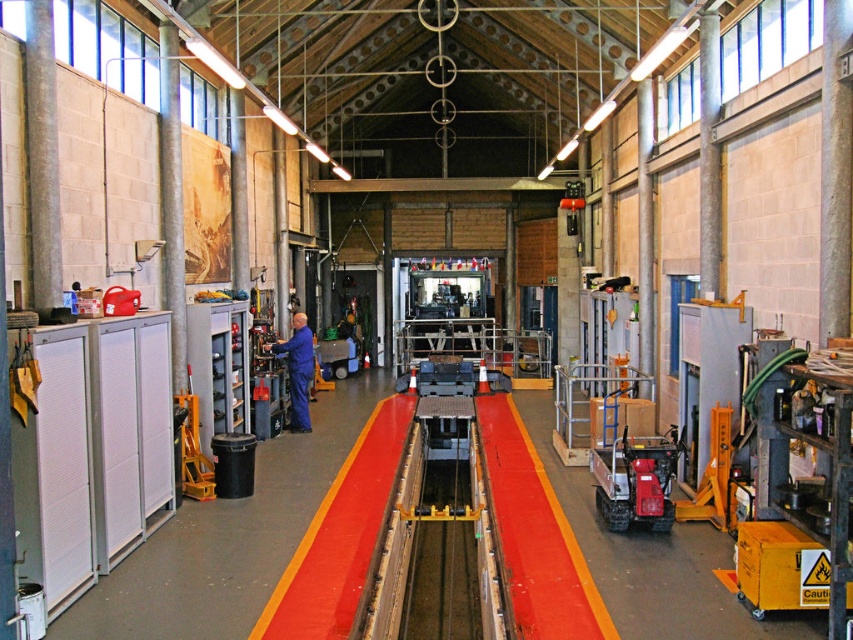
Can you confirm if red plastic forklift at center is positioned to the left of blue uniform at center?

In fact, red plastic forklift at center is to the right of blue uniform at center.

Does red plastic forklift at center have a greater height compared to blue uniform at center?

No.

Find the location of `red plastic forklift at center`. red plastic forklift at center is located at coordinates (636, 481).